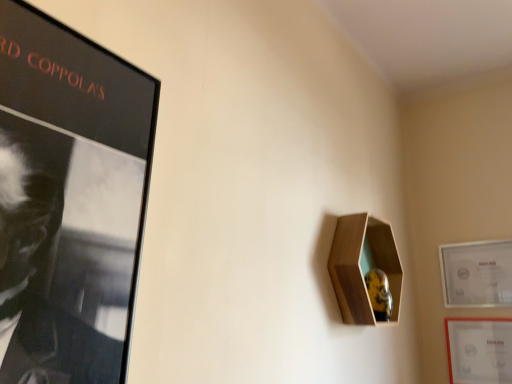
Question: Looking at their shapes, would you say matte white picture frame at right, placed as the first picture frame when sorted from top to bottom, is wider or thinner than wooden hexagonal shelf at upper right?

Choices:
 (A) wide
 (B) thin

Answer: (B)

Question: In the image, is matte white picture frame at right, positioned as the 2th picture frame in bottom-to-top order, positioned in front of or behind wooden hexagonal shelf at upper right?

Choices:
 (A) behind
 (B) front

Answer: (A)

Question: Estimate the real-world distances between objects in this image. Which object is farther from the matte white picture frame at right, positioned as the 2th picture frame in bottom-to-top order?

Choices:
 (A) matte white picture frame at lower right, which is the 2th picture frame in top-to-bottom order
 (B) wooden hexagonal shelf at upper right

Answer: (B)

Question: Which is nearer to the wooden hexagonal shelf at upper right?

Choices:
 (A) matte white picture frame at right, positioned as the 2th picture frame in bottom-to-top order
 (B) matte white picture frame at lower right, which ranks as the first picture frame in bottom-to-top order

Answer: (A)